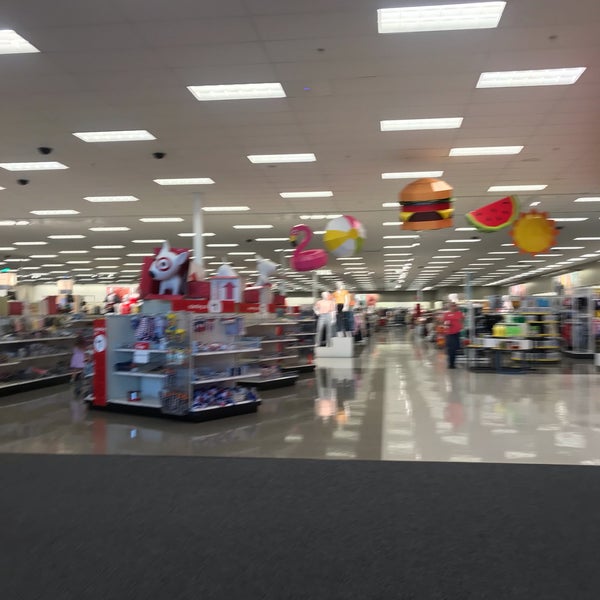
Identify the location of light. The height and width of the screenshot is (600, 600). (399, 446).